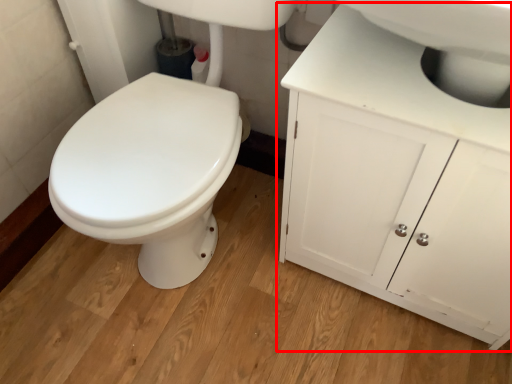
Question: From the image's perspective, where is bathroom cabinet (annotated by the red box) located relative to sink?

Choices:
 (A) above
 (B) below

Answer: (B)